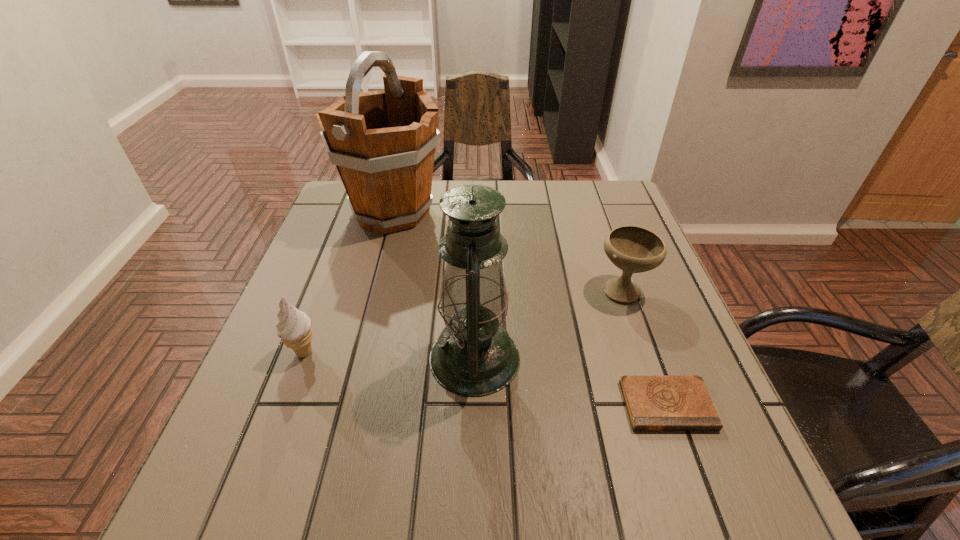
This screenshot has height=540, width=960. I want to click on object that is at the far edge, so click(383, 142).

Image resolution: width=960 pixels, height=540 pixels. I want to click on bucket that is at the left edge, so click(x=383, y=142).

Find the location of a particular element. Image resolution: width=960 pixels, height=540 pixels. icecream located at the left edge is located at coordinates (294, 327).

Where is `chalice that is at the right edge`? chalice that is at the right edge is located at coordinates (633, 249).

The width and height of the screenshot is (960, 540). In order to click on diary present at the right edge in this screenshot , I will do `click(654, 402)`.

The image size is (960, 540). I want to click on object that is at the far left corner, so click(x=383, y=142).

Identify the location of vacant area at the far edge of the desktop. The width and height of the screenshot is (960, 540). (569, 197).

This screenshot has width=960, height=540. Identify the location of free space at the near edge of the desktop. (552, 500).

At what (x,y) coordinates should I click in order to perform the action: click on free space at the left edge of the desktop. Please return your answer as a coordinate pair (x, y). The image size is (960, 540). Looking at the image, I should click on (347, 293).

Where is `vacant space at the right edge of the desktop`? vacant space at the right edge of the desktop is located at coordinates click(x=603, y=247).